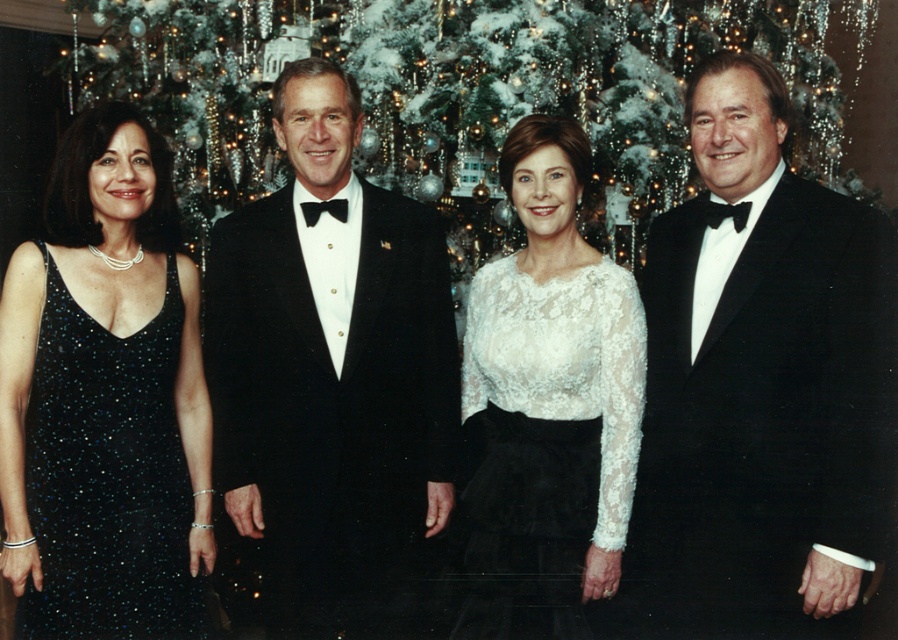
Question: Does black satin tuxedo at right appear over black velvet tuxedo at center?

Choices:
 (A) no
 (B) yes

Answer: (B)

Question: Can you confirm if black velvet tuxedo at center is smaller than white lace blouse at center?

Choices:
 (A) no
 (B) yes

Answer: (A)

Question: Which object is positioned closest to the white lace blouse at center?

Choices:
 (A) sparkly black dress at left
 (B) black velvet tuxedo at center
 (C) black satin tuxedo at right

Answer: (C)

Question: Can you confirm if black velvet tuxedo at center is wider than sparkly black dress at left?

Choices:
 (A) yes
 (B) no

Answer: (A)

Question: Which is farther from the black velvet tuxedo at center?

Choices:
 (A) black satin tuxedo at right
 (B) sparkly black dress at left
 (C) white lace blouse at center

Answer: (A)

Question: Which of the following is the closest to the observer?

Choices:
 (A) white lace blouse at center
 (B) black satin tuxedo at right
 (C) black velvet tuxedo at center
 (D) sparkly black dress at left

Answer: (B)